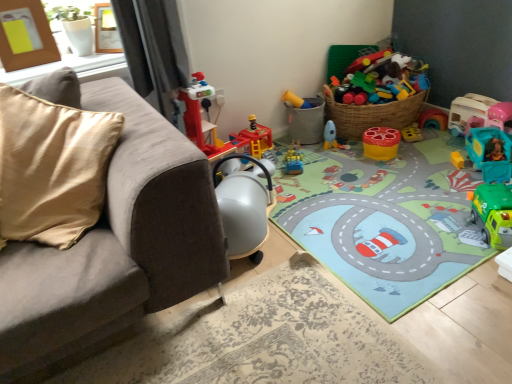
Image resolution: width=512 pixels, height=384 pixels. I want to click on free space between green plastic toy car at lower right, placed as the 3th toy when sorted from right to left, and yellow matte stool at center, arranged as the 3th toy when viewed from the left, so click(428, 185).